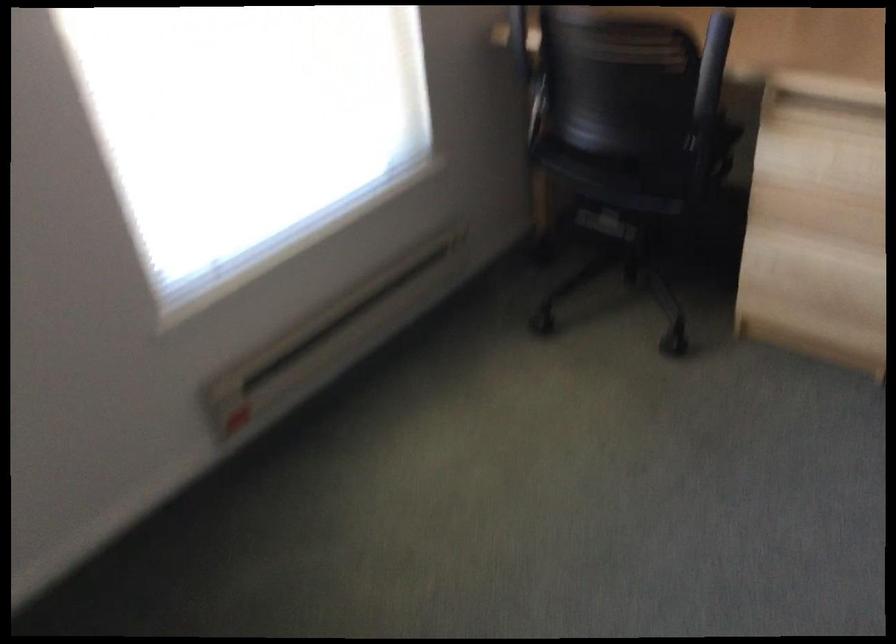
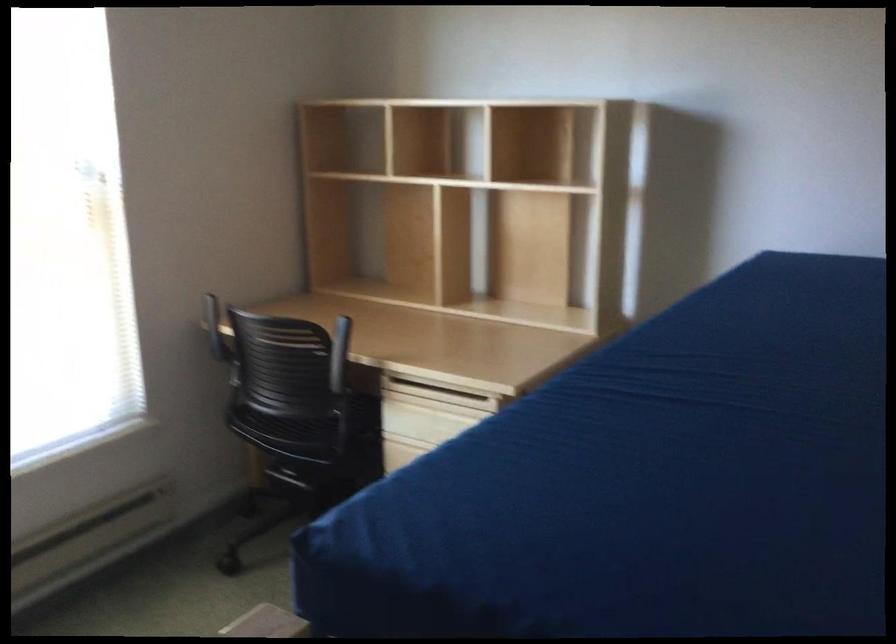
What movement of the cameraman would produce the second image?

The cameraman moved toward right, backward.